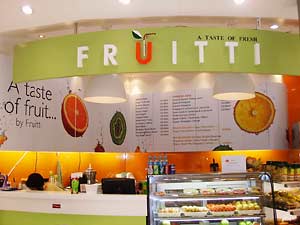
Locate an element on the screen. This screenshot has width=300, height=225. dispenser is located at coordinates (89, 173).